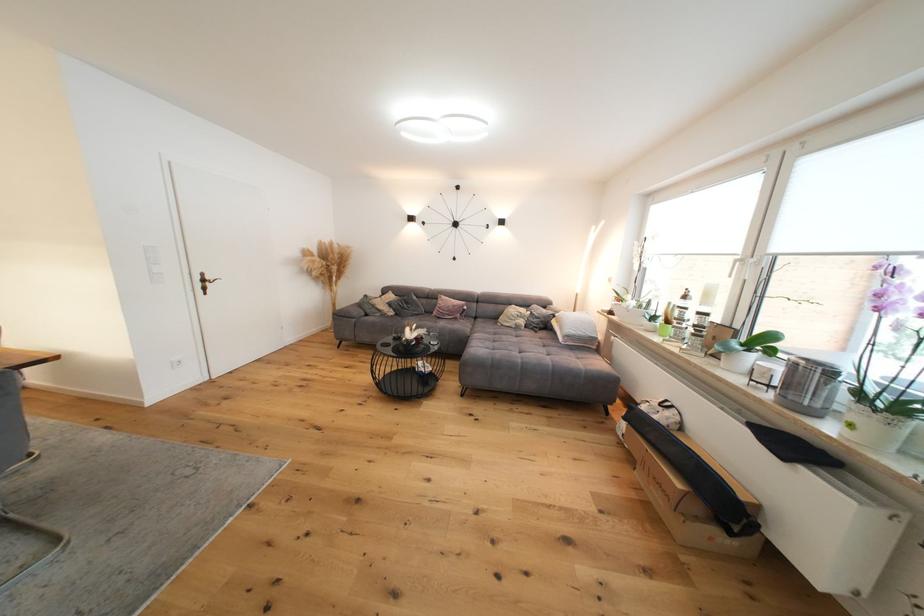
Describe the element at coordinates (823, 467) in the screenshot. Image resolution: width=924 pixels, height=616 pixels. I see `the blind pull tab` at that location.